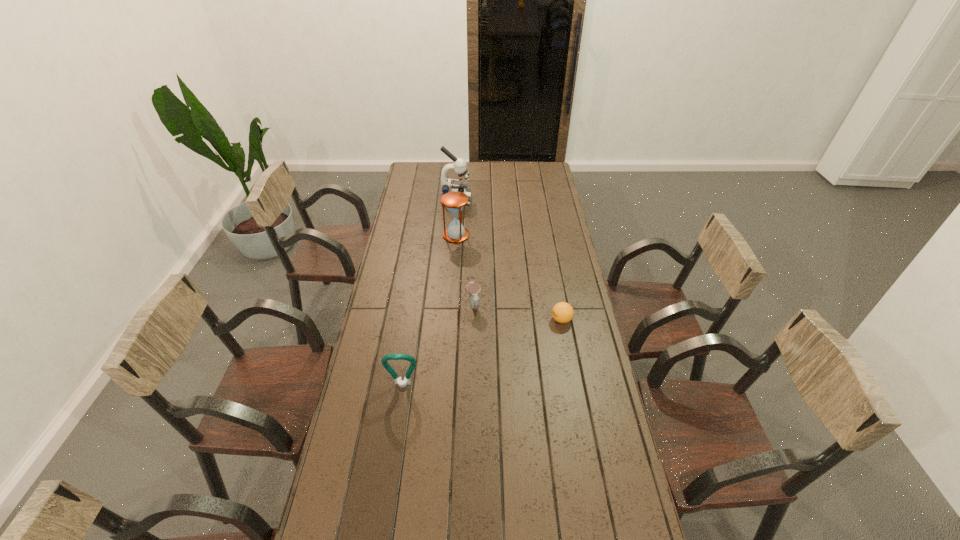
At what (x,y) coordinates should I click in order to perform the action: click on vacant space located 0.250m at the jaws of the nearest object. Please return your answer as a coordinate pair (x, y). This screenshot has width=960, height=540. Looking at the image, I should click on (391, 464).

You are a GUI agent. You are given a task and a screenshot of the screen. Output one action in this format:
    pyautogui.click(x=<x>, y=<y>)
    Task: Click on the blank space located on the back of the watch
    
    Given the screenshot: What is the action you would take?
    pyautogui.click(x=474, y=238)

Identify the location of vacant space located on the side with brand of the ping-pong ball. (496, 320).

The image size is (960, 540). I want to click on vacant point located 0.360m on the side with brand of the ping-pong ball, so click(x=458, y=320).

This screenshot has height=540, width=960. I want to click on vacant space located on the side with brand of the ping-pong ball, so click(x=492, y=320).

Find the location of a particular element. The width and height of the screenshot is (960, 540). object at the left edge is located at coordinates (402, 383).

Find the location of a particular element. object positioned at the right edge is located at coordinates [562, 312].

Identify the location of free space at the far edge of the desktop. The image size is (960, 540). (488, 181).

The image size is (960, 540). I want to click on vacant space at the left edge, so click(392, 313).

At what (x,y) coordinates should I click in order to perform the action: click on free space at the right edge of the desktop. Please return your answer as a coordinate pair (x, y). The width and height of the screenshot is (960, 540). Looking at the image, I should click on (601, 484).